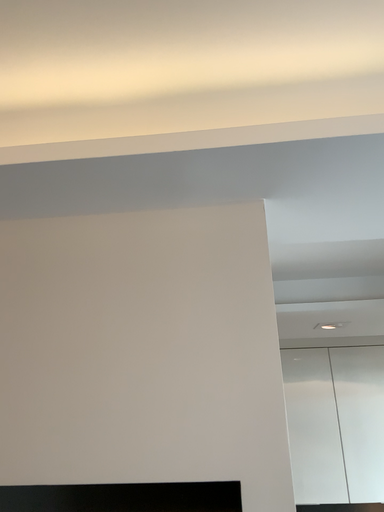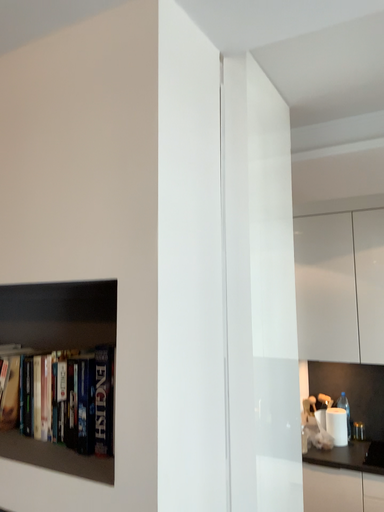
Question: Which way did the camera rotate in the video?

Choices:
 (A) rotated left
 (B) rotated right

Answer: (A)